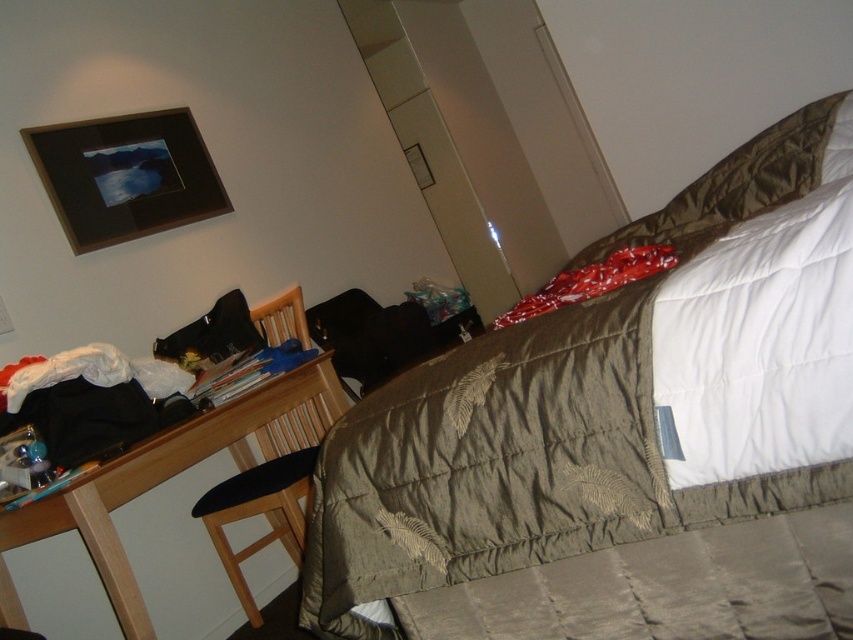
Between black wood picture frame at upper left and wooden chair at center, which one is positioned higher?

Positioned higher is black wood picture frame at upper left.

What are the coordinates of `black wood picture frame at upper left` in the screenshot? It's located at (125, 176).

Looking at this image, which of these two, textured olive green comforter at center or wooden chair at center, stands taller?

With more height is wooden chair at center.

Which is above, textured olive green comforter at center or wooden chair at center?

textured olive green comforter at center is above.

Is point (495, 440) closer to viewer compared to point (242, 484)?

Yes, it is.

You are a GUI agent. You are given a task and a screenshot of the screen. Output one action in this format:
    pyautogui.click(x=<x>, y=<y>)
    Task: Click on the textured olive green comforter at center
    This screenshot has width=853, height=640.
    Given the screenshot: What is the action you would take?
    pyautogui.click(x=625, y=438)

The height and width of the screenshot is (640, 853). Describe the element at coordinates (154, 486) in the screenshot. I see `wooden desk at lower left` at that location.

Measure the distance between wooden desk at lower left and camera.

wooden desk at lower left and camera are 1.58 meters apart.

Identify the location of wooden desk at lower left. (154, 486).

Find the location of a particular element. This screenshot has width=853, height=640. wooden desk at lower left is located at coordinates (154, 486).